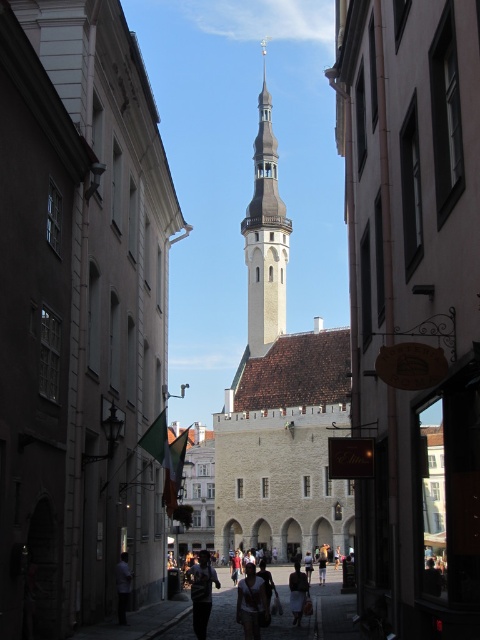
You are a tourist walking down the cobblestone street and want to take a photo of the light beige fabric dress at center without the white stone bell tower at center blocking the view. Is this possible?

The light beige fabric dress at center is behind the white stone bell tower at center, so it is currently blocked by the tower. To take a photo without the tower blocking the view, you would need to move around the tower to a position where the dress is visible without the tower obstructing it.

You are a tourist standing on the cobblestone street and want to take a photo of the white stone bell tower at center. Your camera can focus on objects up to 400 feet away. Will the tower be in focus?

The white stone bell tower at center is 385.22 feet away from the viewer, which is within the camera focus range of 400 feet. Therefore, the tower will be in focus.